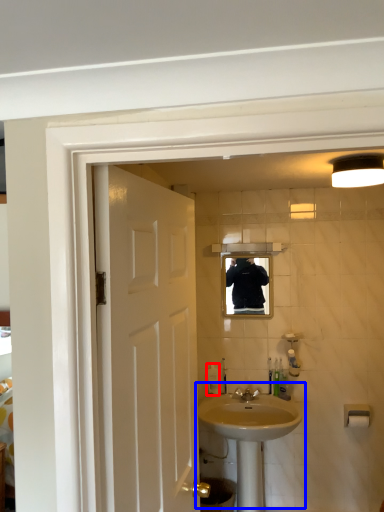
Question: Among these objects, which one is farthest to the camera, soap dispenser (highlighted by a red box) or sink (highlighted by a blue box)?

Choices:
 (A) soap dispenser
 (B) sink

Answer: (A)